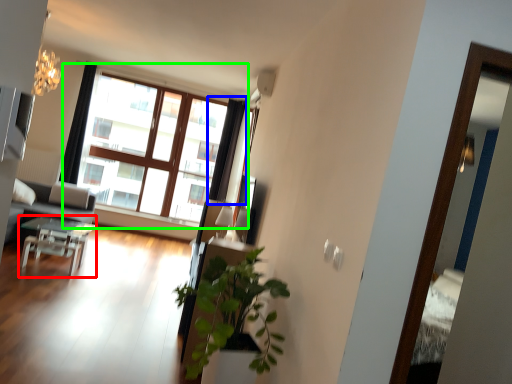
Question: Considering the real-world distances, which object is farthest from table (highlighted by a red box)? curtain (highlighted by a blue box) or window (highlighted by a green box)?

Choices:
 (A) curtain
 (B) window

Answer: (A)